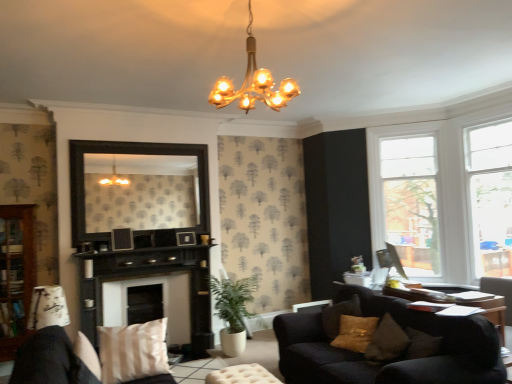
Question: From a real-world perspective, does dark wood mirror at center stand above black wood fireplace at center, the second fireplace from the back?

Choices:
 (A) no
 (B) yes

Answer: (B)

Question: Is dark wood mirror at center smaller than black wood fireplace at center, the 1th fireplace positioned from the front?

Choices:
 (A) no
 (B) yes

Answer: (B)

Question: From the image's perspective, is dark wood mirror at center below black wood fireplace at center, the second fireplace from the back?

Choices:
 (A) no
 (B) yes

Answer: (A)

Question: Is dark wood mirror at center shorter than black wood fireplace at center, the 1th fireplace positioned from the front?

Choices:
 (A) no
 (B) yes

Answer: (B)

Question: Could you tell me if dark wood mirror at center is turned towards black wood fireplace at center, the 1th fireplace positioned from the front?

Choices:
 (A) no
 (B) yes

Answer: (A)

Question: From the image's perspective, is white wood window frame at upper right, the 1th window frame viewed from the right, positioned above or below white wood window frame at upper right, which appears as the second window frame when viewed from the front?

Choices:
 (A) above
 (B) below

Answer: (A)

Question: Do you think white wood window frame at upper right, which is counted as the 2th window frame, starting from the back, is within white wood window frame at upper right, the 1th window frame from the back, or outside of it?

Choices:
 (A) inside
 (B) outside

Answer: (B)

Question: Considering their positions, is white wood window frame at upper right, the second window frame positioned from the left, located in front of or behind white wood window frame at upper right, which appears as the second window frame when viewed from the front?

Choices:
 (A) front
 (B) behind

Answer: (A)

Question: In terms of size, does white wood window frame at upper right, the second window frame positioned from the left, appear bigger or smaller than white wood window frame at upper right, the 1th window frame from the back?

Choices:
 (A) small
 (B) big

Answer: (A)

Question: From the image's perspective, is green leafy plant at lower center above or below beige fabric pillow at lower left?

Choices:
 (A) below
 (B) above

Answer: (A)

Question: Considering the positions of green leafy plant at lower center and beige fabric pillow at lower left in the image, is green leafy plant at lower center taller or shorter than beige fabric pillow at lower left?

Choices:
 (A) tall
 (B) short

Answer: (A)

Question: Is green leafy plant at lower center in front of or behind beige fabric pillow at lower left in the image?

Choices:
 (A) behind
 (B) front

Answer: (A)

Question: Is green leafy plant at lower center to the left or to the right of beige fabric pillow at lower left in the image?

Choices:
 (A) right
 (B) left

Answer: (A)

Question: Is dark wood mirror at center inside or outside of matte white lampshade at lower left, the 1th lamp from the left?

Choices:
 (A) inside
 (B) outside

Answer: (B)

Question: In terms of height, does dark wood mirror at center look taller or shorter compared to matte white lampshade at lower left, which appears as the 1th lamp when ordered from the bottom?

Choices:
 (A) tall
 (B) short

Answer: (A)